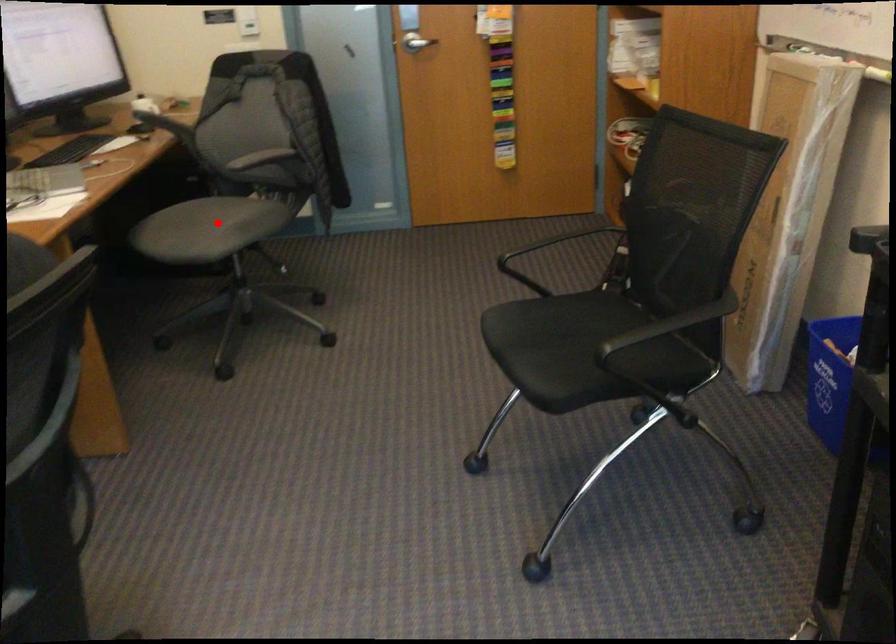
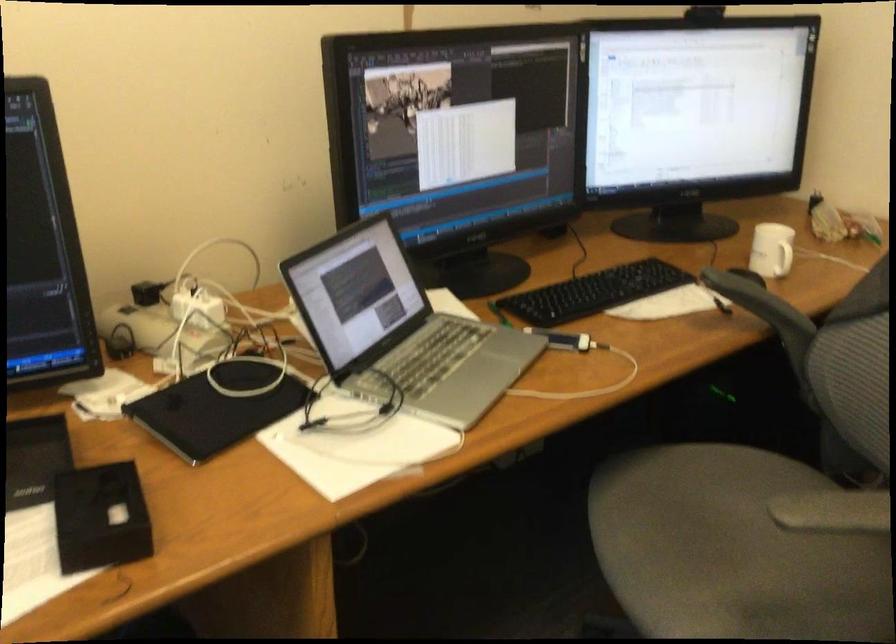
Question: A red point is marked in image1. In image2, is the corresponding 3D point closer to the camera or farther? Reply with the corresponding letter.

Choices:
 (A) The corresponding 3D point is closer.
 (B) The corresponding 3D point is farther.

Answer: (A)